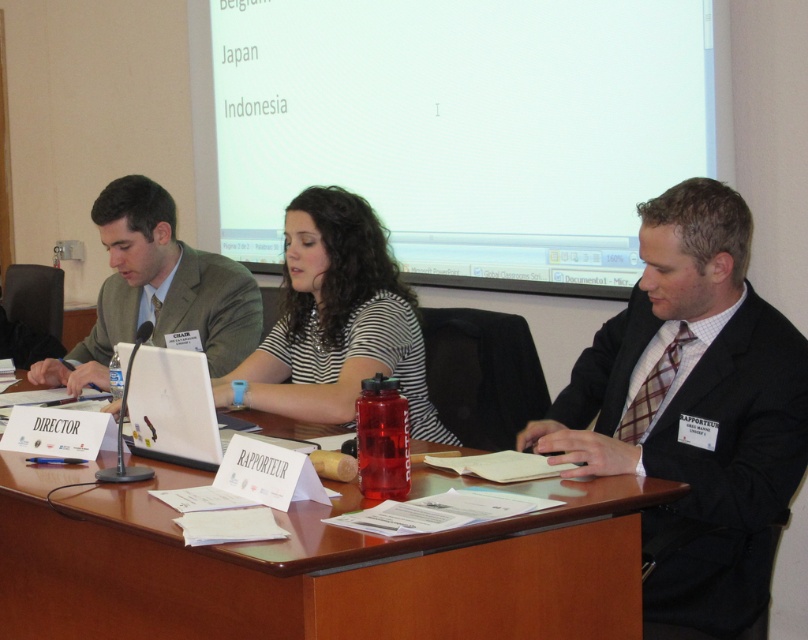
Based on the scene described, if someone is sitting at the wooden table at center, which direction should they look to see the white matte projector screen at upper center?

The white matte projector screen at upper center is to the right of the wooden table at center, so the person should look to their right to see it.

You are organizing a meeting and need to place a new nameplate between the black suit at right and the white plastic laptop at center. Based on their positions, where should you place the nameplate?

The black suit at right is to the right of the white plastic laptop at center, so the nameplate should be placed between them to the left of the black suit at right and to the right of the white plastic laptop at center.

You are standing at the back of the conference room and want to place a small plant on the table between the two points, point[743,566] and point[149,355]. Which point should the plant be closer to if you want it to be nearer to you?

The plant should be placed closer to point[743,566] because it is closer to the viewer than point[149,355].